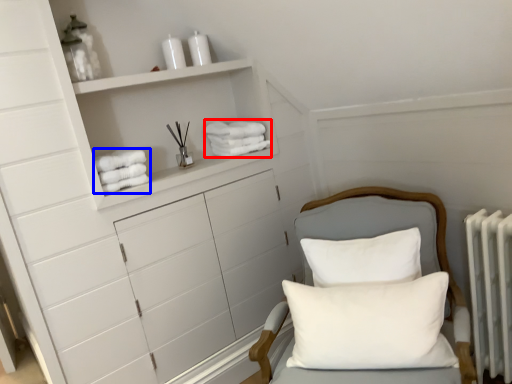
Question: Which of the following is the farthest to the observer, bath towel (highlighted by a red box) or bath towel (highlighted by a blue box)?

Choices:
 (A) bath towel
 (B) bath towel

Answer: (A)